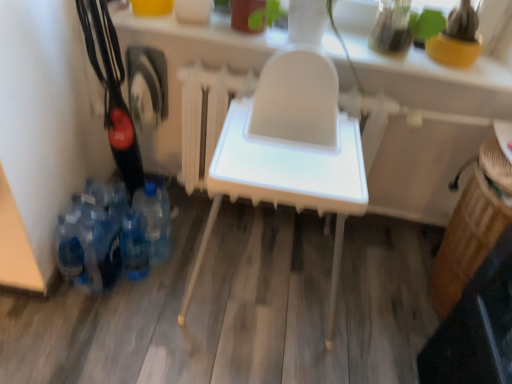
Question: Considering the positions of white plastic highchair at center and blue translucent bottle at lower left, the second bottle when ordered from right to left, in the image, is white plastic highchair at center wider or thinner than blue translucent bottle at lower left, the second bottle when ordered from right to left,?

Choices:
 (A) thin
 (B) wide

Answer: (B)

Question: Does point pos(372,87) appear closer or farther from the camera than point pos(146,246)?

Choices:
 (A) farther
 (B) closer

Answer: (A)

Question: Which object is positioned closest to the blue translucent bottle at lower left, the second bottle in the left-to-right sequence?

Choices:
 (A) white plastic high chair at center
 (B) blue plastic bottles at lower left, which ranks as the first bottle in left-to-right order
 (C) white plastic highchair at center
 (D) blue plastic bottle at lower left, marked as the 3th bottle in a left-to-right arrangement

Answer: (B)

Question: Which is farther from the blue plastic bottle at lower left, marked as the 3th bottle in a left-to-right arrangement?

Choices:
 (A) blue plastic bottles at lower left, which ranks as the first bottle in left-to-right order
 (B) white plastic highchair at center
 (C) white plastic high chair at center
 (D) blue translucent bottle at lower left, the second bottle in the left-to-right sequence

Answer: (B)